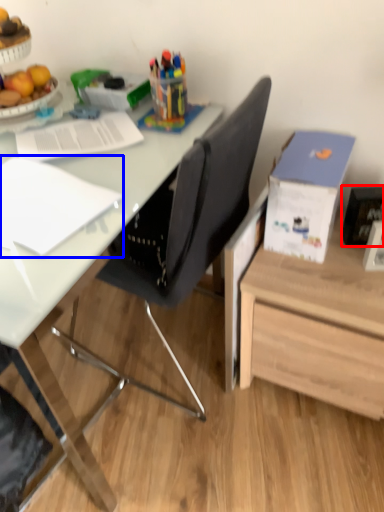
Question: Which point is closer to the camera, picture frame (highlighted by a red box) or notebook (highlighted by a blue box)?

Choices:
 (A) picture frame
 (B) notebook

Answer: (B)